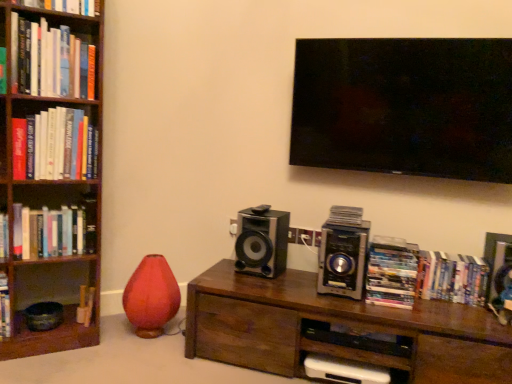
You are a GUI agent. You are given a task and a screenshot of the screen. Output one action in this format:
    pyautogui.click(x=<x>, y=<y>)
    Task: Click on the vacant area that is in front of hardcover books at center right, the 1th book from the right
    The height and width of the screenshot is (384, 512).
    Given the screenshot: What is the action you would take?
    pyautogui.click(x=457, y=310)